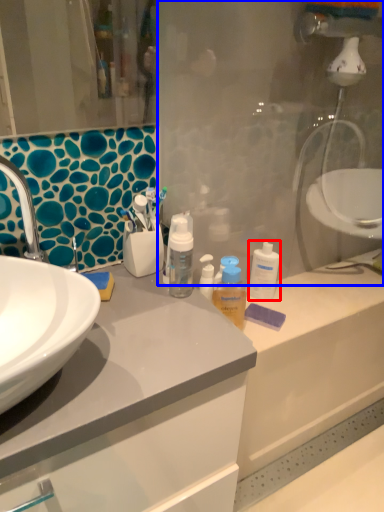
Question: Which of the following is the farthest to the observer, cleaning product (highlighted by a red box) or glass door (highlighted by a blue box)?

Choices:
 (A) cleaning product
 (B) glass door

Answer: (A)